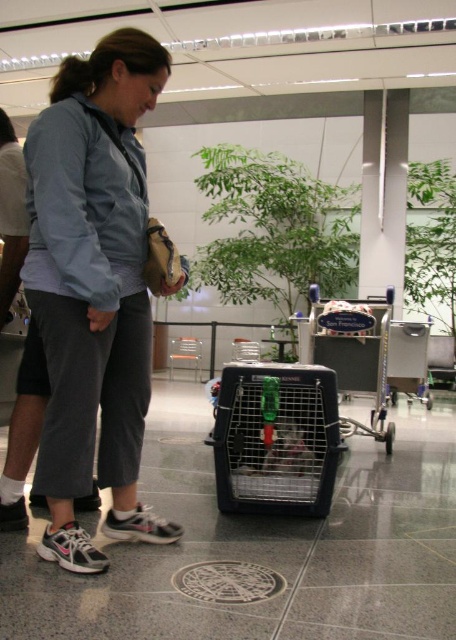
You are a traveler trying to place your gray fabric pants at lower center next to the black plastic pet carrier at center in the image. Can you fit both items side by side on a luggage rack that is 1 meter wide?

The gray fabric pants at lower center is thinner than the black plastic pet carrier at center. Therefore, both items can likely fit side by side on a 1 meter wide luggage rack since their combined width would be less than the rack width.

You are a service robot in an airport terminal. You need to move a luggage cart from your current position to the black plastic pet carrier at center without hitting the gray fabric pants at lower center. Can you safely navigate the 25.99 inches between them?

The distance between the gray fabric pants at lower center and the black plastic pet carrier at center is 25.99 inches. Since the robot needs to move the luggage cart without hitting either object, it should be possible as long as the cart is maneuvered carefully within that space.

You are a traveler trying to locate your luggage cart and pet carrier in the airport terminal. You see the black plastic pet carrier at center and the metallic silver shopping cart at center. Which object is positioned to the left?

The black plastic pet carrier at center is positioned to the left of the metallic silver shopping cart at center.